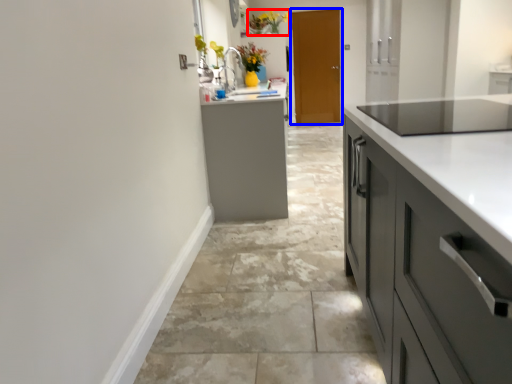
Question: Which object appears farthest to the camera in this image, floral arrangement (highlighted by a red box) or door (highlighted by a blue box)?

Choices:
 (A) floral arrangement
 (B) door

Answer: (B)